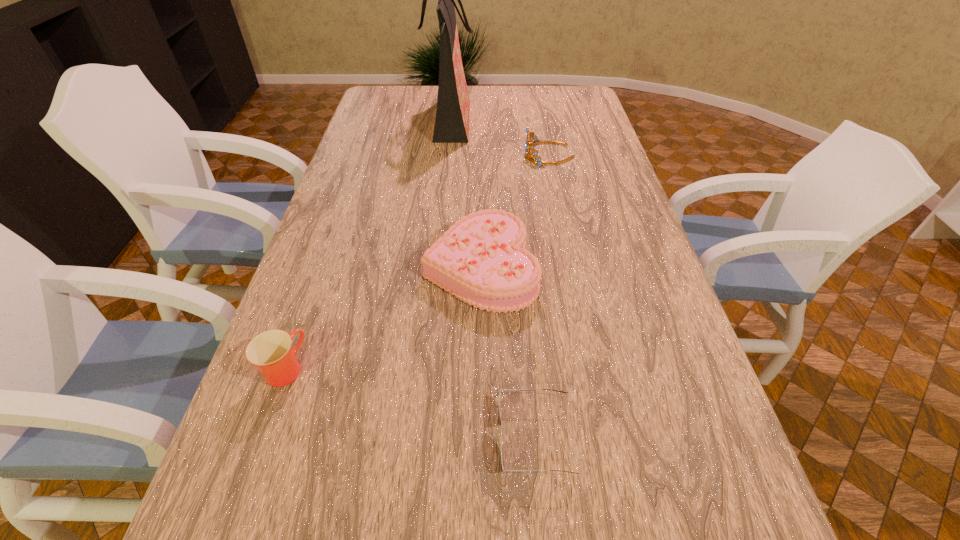
Identify the location of vacant point located on the front-facing side of the tiara. (444, 154).

Find the location of a particular element. free location located 0.080m on the right of the cup is located at coordinates (344, 368).

Image resolution: width=960 pixels, height=540 pixels. In order to click on vacant point located 0.270m on the right of the cake in this screenshot , I will do `click(641, 267)`.

The height and width of the screenshot is (540, 960). Find the location of `free space located on the front-facing side of the shortest object`. free space located on the front-facing side of the shortest object is located at coordinates (425, 437).

The width and height of the screenshot is (960, 540). I want to click on free region located on the front-facing side of the shortest object, so click(324, 437).

You are a GUI agent. You are given a task and a screenshot of the screen. Output one action in this format:
    pyautogui.click(x=<x>, y=<y>)
    Task: Click on the free spot located 0.280m on the front-facing side of the shortest object
    
    Given the screenshot: What is the action you would take?
    pyautogui.click(x=350, y=437)

The width and height of the screenshot is (960, 540). I want to click on object at the far edge, so click(x=453, y=103).

At what (x,y) coordinates should I click in order to perform the action: click on object that is at the left edge. Please return your answer as a coordinate pair (x, y). Looking at the image, I should click on (271, 351).

Find the location of `object that is at the right edge`. object that is at the right edge is located at coordinates (528, 144).

At what (x,y) coordinates should I click in order to perform the action: click on free region at the far edge of the desktop. Please return your answer as a coordinate pair (x, y). Looking at the image, I should click on tap(511, 86).